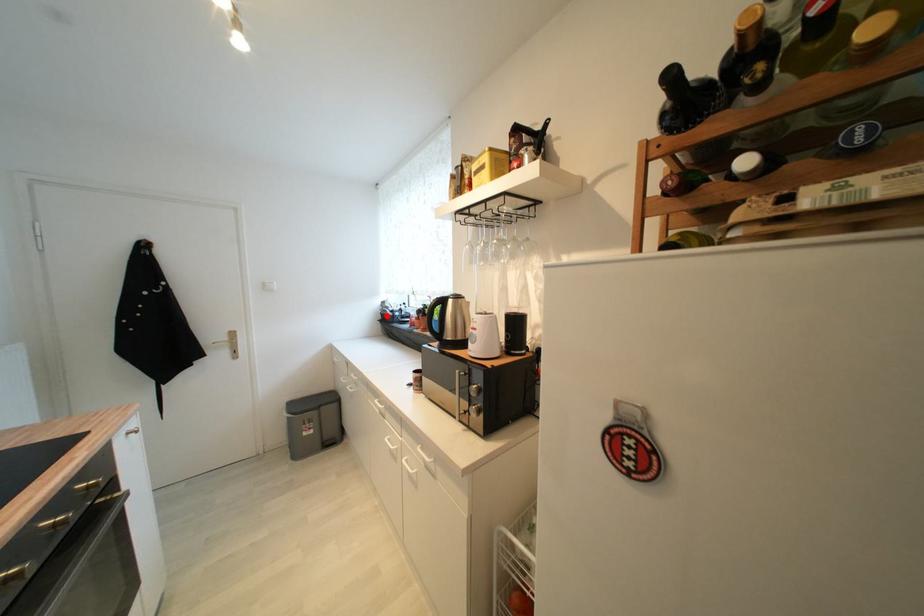
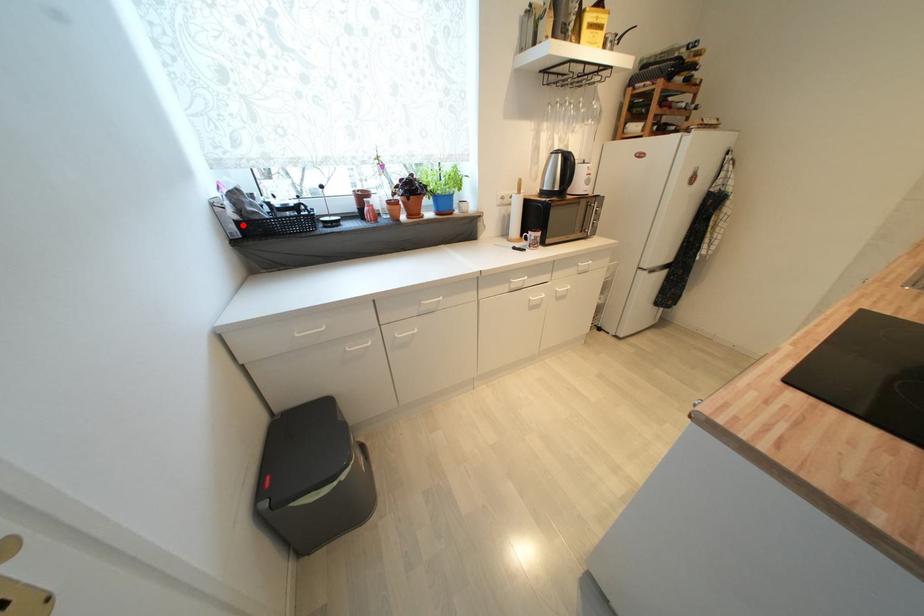
I am providing you with two images of the same scene from different viewpoints. A red point is marked on the first image and another point is marked on the second image. Is the red point in image1 aligned with the point shown in image2?

Yes